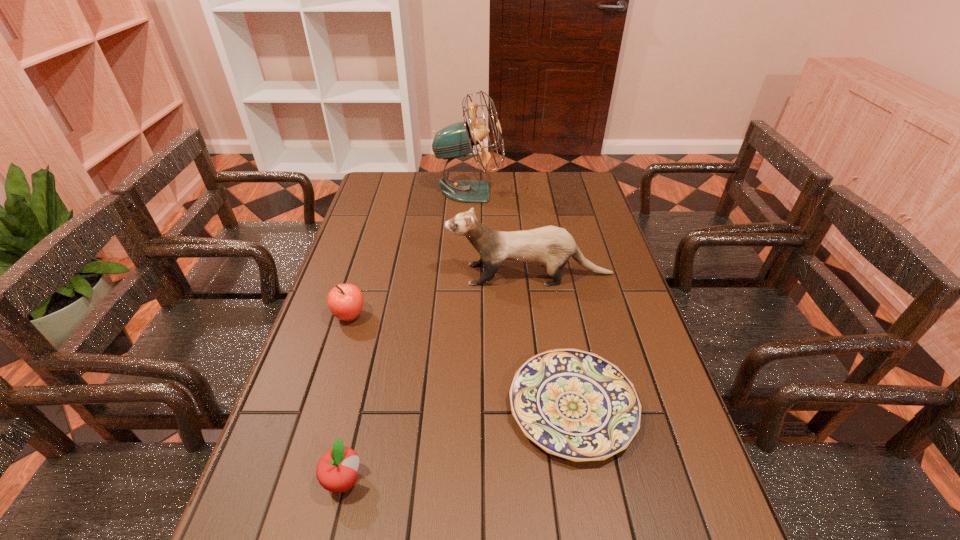
This screenshot has width=960, height=540. Identify the location of vacant space located 0.070m on the face of the fourth nearest object. (423, 274).

Where is `vacant space located 0.270m on the face of the fourth nearest object`? vacant space located 0.270m on the face of the fourth nearest object is located at coordinates (357, 274).

In order to click on vacant space located on the face of the fourth nearest object in this screenshot , I will do `click(361, 274)`.

You are a GUI agent. You are given a task and a screenshot of the screen. Output one action in this format:
    pyautogui.click(x=<x>, y=<y>)
    Task: Click on the free spot located 0.140m on the back of the left apple
    
    Given the screenshot: What is the action you would take?
    pyautogui.click(x=363, y=272)

Find the location of `vacant area located 0.230m on the right of the second object from left to right`. vacant area located 0.230m on the right of the second object from left to right is located at coordinates (481, 481).

Find the location of a particular element. This screenshot has height=540, width=960. free space located on the back of the shortest object is located at coordinates pyautogui.click(x=557, y=318).

Identify the location of object that is at the far edge. The width and height of the screenshot is (960, 540). (456, 140).

Where is `ferret present at the right edge`? This screenshot has height=540, width=960. ferret present at the right edge is located at coordinates (551, 246).

Where is `plate that is at the right edge`? plate that is at the right edge is located at coordinates 573,404.

Find the location of a particular element. The height and width of the screenshot is (540, 960). blank area at the far edge is located at coordinates [x=499, y=181].